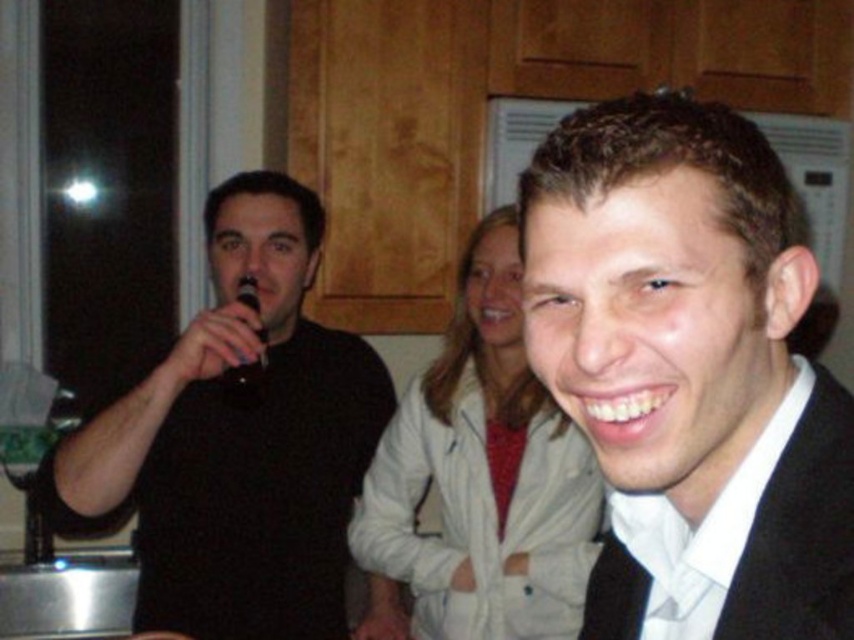
Based on the photo, you are a photographer at a party and want to take a photo of the black matte suit at center and the black matte microphone at left. Can you see both objects clearly in the photo?

The black matte suit at center is in front of the black matte microphone at left, so the microphone might be partially obscured by the suit in the photo.

You are setting up a stage for a small event and need to place both the black matte microphone at left and the black plastic microphone at left on a shelf. If the shelf can only hold items up to 10 cm in width, which microphone should you choose to ensure it fits?

The black plastic microphone at left should be chosen because it might be narrower than the black matte microphone at left, which could exceed the shelf width limit.

You are planning to take a photo of the black matte suit at center and the black plastic microphone at left. Which object should you focus on first if you want to capture both clearly in your shot?

The black matte suit at center is bigger than the black plastic microphone at left, so you should focus on the black matte suit at center first to ensure it is in clear focus before adjusting for the smaller microphone.